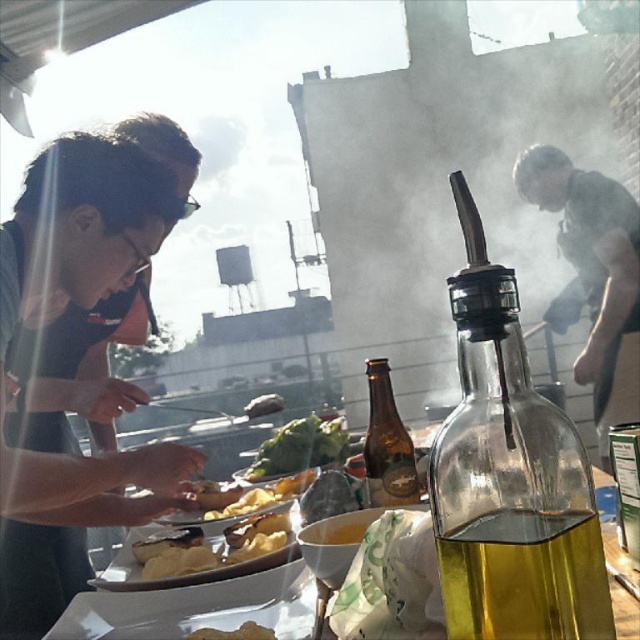
Between clear glass bottle at center and brown glass bottle at center, which one is positioned higher?

clear glass bottle at center is higher up.

Is clear glass bottle at center positioned behind brown glass bottle at center?

No.

In order to click on clear glass bottle at center in this screenshot , I will do `click(509, 477)`.

Find the location of a particular element. The width and height of the screenshot is (640, 640). clear glass bottle at center is located at coordinates (509, 477).

Does golden glass bottle at center appear under gray fabric shirt at upper right?

Correct, golden glass bottle at center is located below gray fabric shirt at upper right.

Who is positioned more to the right, golden glass bottle at center or gray fabric shirt at upper right?

From the viewer's perspective, gray fabric shirt at upper right appears more on the right side.

Is point (564, 531) behind point (628, 220)?

No, (564, 531) is closer to viewer.

Find the location of a particular element. The image size is (640, 640). golden glass bottle at center is located at coordinates (525, 577).

Is yellow matte chips at center below yellow matte bread at center?

Yes.

Which of these two, yellow matte chips at center or yellow matte bread at center, stands taller?

yellow matte chips at center is taller.

The image size is (640, 640). I want to click on yellow matte chips at center, so click(220, 548).